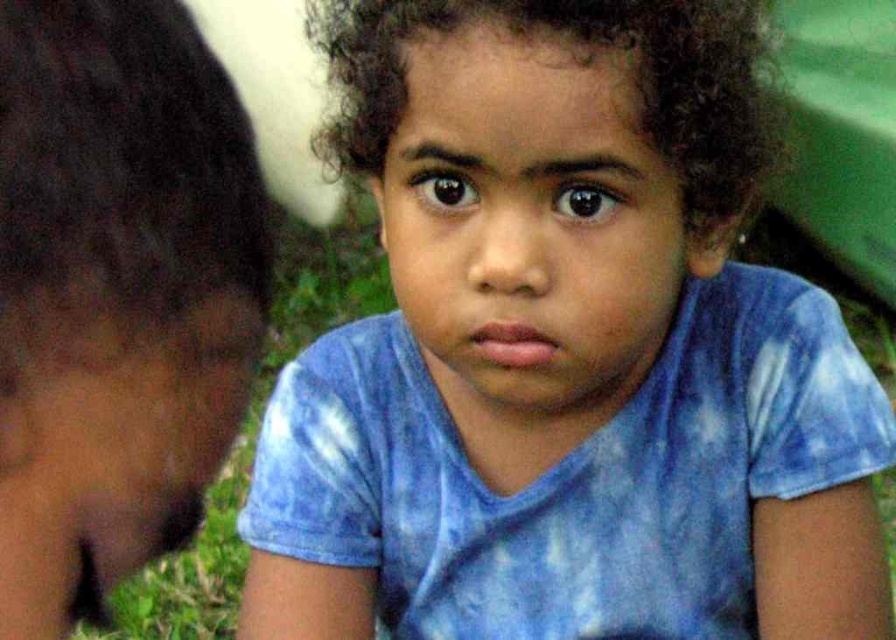
Between brown hair at left and green grass at lower left, which one is positioned higher?

brown hair at left

Which of these two, brown hair at left or green grass at lower left, stands shorter?

brown hair at left is shorter.

Locate an element on the screen. brown hair at left is located at coordinates (116, 294).

Locate an element on the screen. The image size is (896, 640). brown hair at left is located at coordinates (116, 294).

Does point (751, 288) come in front of point (76, 236)?

No, it is behind (76, 236).

Can you confirm if blue tie-dye shirt at center is wider than brown hair at left?

Yes.

Find the location of `blue tie-dye shirt at center`. blue tie-dye shirt at center is located at coordinates (565, 349).

Image resolution: width=896 pixels, height=640 pixels. I want to click on blue tie-dye shirt at center, so click(565, 349).

Is blue tie-dye shirt at center below green grass at lower left?

Actually, blue tie-dye shirt at center is above green grass at lower left.

Is blue tie-dye shirt at center in front of green grass at lower left?

That is True.

Image resolution: width=896 pixels, height=640 pixels. In order to click on blue tie-dye shirt at center in this screenshot , I will do `click(565, 349)`.